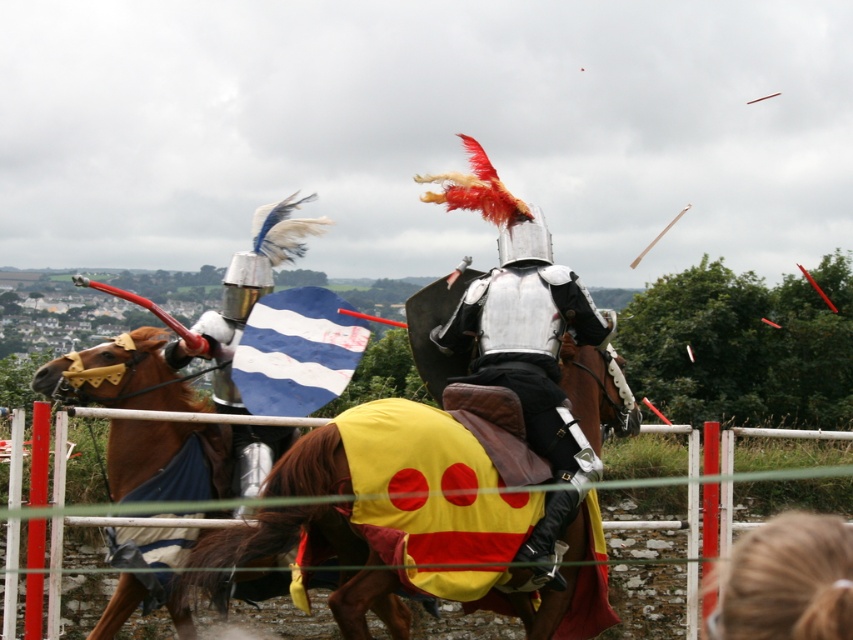
Question: Among these points, which one is nearest to the camera?

Choices:
 (A) (108, 461)
 (B) (212, 545)

Answer: (B)

Question: Which point is closer to the camera taking this photo?

Choices:
 (A) (808, 541)
 (B) (189, 522)

Answer: (A)

Question: Is brown glossy horse at left behind blonde hair at lower right?

Choices:
 (A) no
 (B) yes

Answer: (B)

Question: Does yellow fabric horse at center appear on the left side of shiny silver armor at center?

Choices:
 (A) yes
 (B) no

Answer: (A)

Question: Which point appears farthest from the camera in this image?

Choices:
 (A) (553, 497)
 (B) (448, 532)

Answer: (A)

Question: Is brown glossy horse at left further to camera compared to blonde hair at lower right?

Choices:
 (A) no
 (B) yes

Answer: (B)